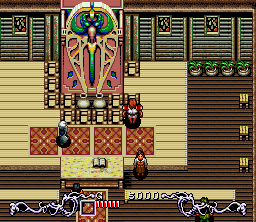
Identify the location of window. (167, 24).